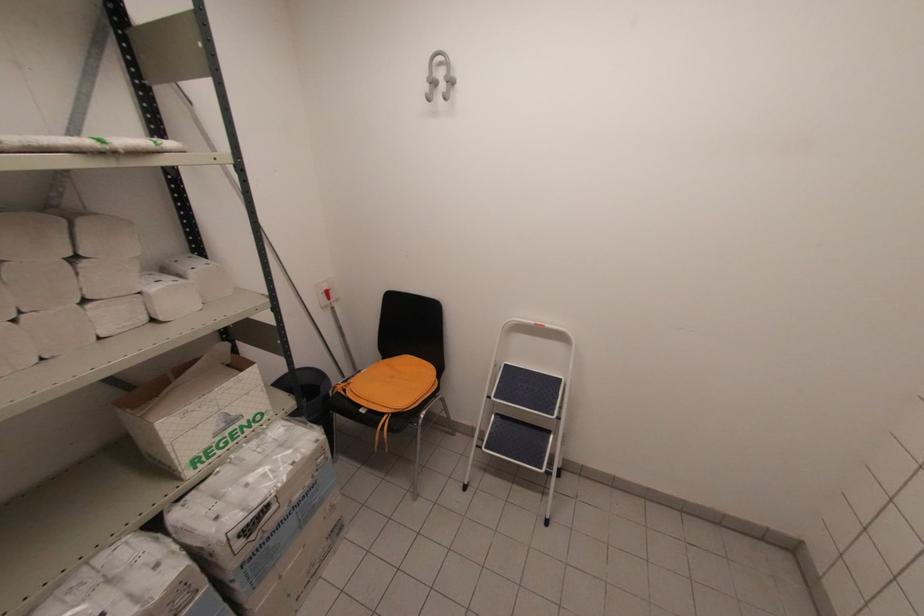
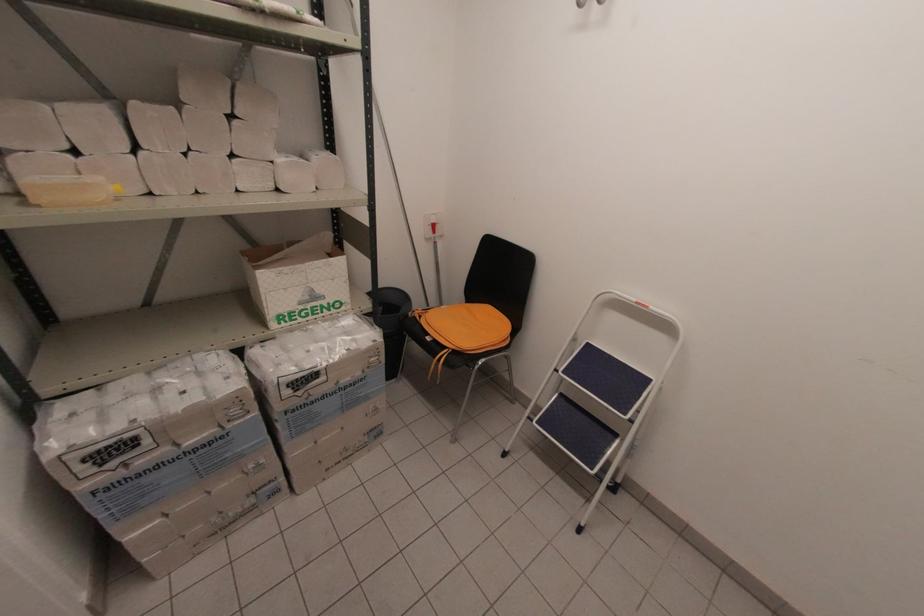
In the second image, find the point that corresponds to [224,426] in the first image.

(309, 298)